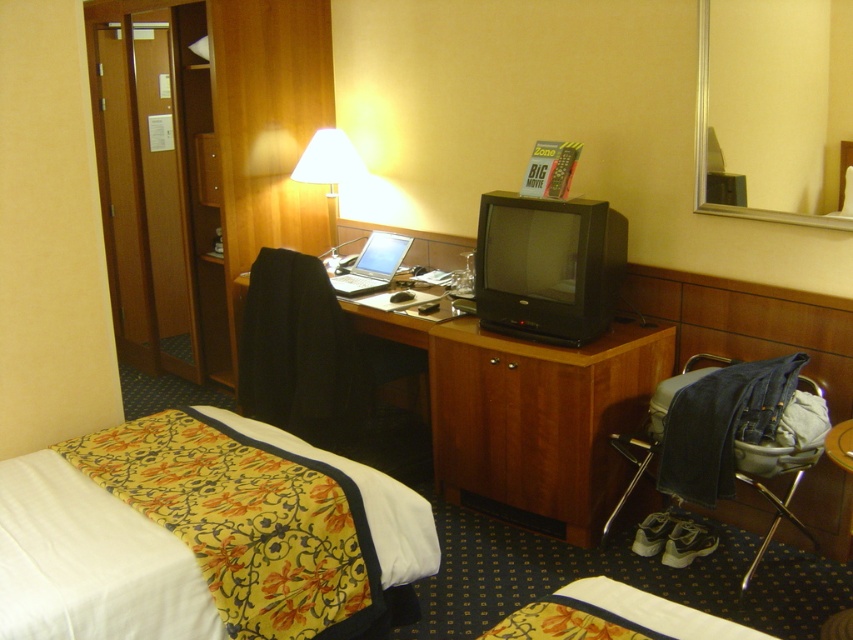
You are a guest in the hotel room and want to move from the bed to the desk without walking around the chair. Can you walk directly between the floral fabric bed at lower left and the black fabric chair at center?

The floral fabric bed at lower left is in front of the black fabric chair at center, meaning they are aligned along the same line from your perspective. This suggests there is no space between them for you to walk directly through. You would need to go around either side or behind the chair to reach the desk.

You are standing in the hotel room and want to place a 10 feet long ladder in the room. The ladder must be placed near the woodendesk at center. Is there enough space to place it there?

The woodendesk at center is 8.76 feet away from viewer. Since the ladder is 10 feet long, there might not be enough space to place it near the woodendesk at center as the distance from the viewer to the desk is shorter than the ladder length.